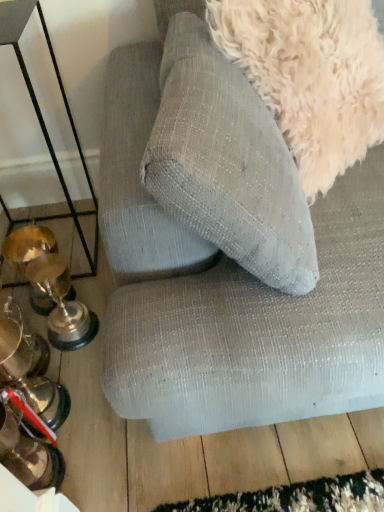
The width and height of the screenshot is (384, 512). In order to click on fuzzy white dog at upper right in this screenshot , I will do `click(310, 76)`.

This screenshot has width=384, height=512. What do you see at coordinates (44, 121) in the screenshot?
I see `metallic trophies at left` at bounding box center [44, 121].

The height and width of the screenshot is (512, 384). Identify the location of fuzzy white dog at upper right. (310, 76).

From a real-world perspective, is metallic trophies at left located beneath fuzzy white dog at upper right?

Yes, from a real-world perspective, metallic trophies at left is below fuzzy white dog at upper right.

Can you confirm if metallic trophies at left is bigger than fuzzy white dog at upper right?

Yes, metallic trophies at left is bigger than fuzzy white dog at upper right.

From the image's perspective, is metallic trophies at left positioned above or below fuzzy white dog at upper right?

Clearly, from the image's perspective, metallic trophies at left is below fuzzy white dog at upper right.

Which is more to the right, metallic trophies at left or fuzzy white dog at upper right?

fuzzy white dog at upper right is more to the right.

Does textured fabric couch at upper center lie behind metallic trophies at left?

No, it is in front of metallic trophies at left.

Which of these two, textured fabric couch at upper center or metallic trophies at left, stands shorter?

Standing shorter between the two is metallic trophies at left.

Based on the photo, between textured fabric couch at upper center and metallic trophies at left, which one has larger width?

Wider between the two is textured fabric couch at upper center.

From the image's perspective, is textured fabric couch at upper center above or below metallic trophies at left?

textured fabric couch at upper center is situated lower than metallic trophies at left in the image.

Based on the photo, from a real-world perspective, who is located higher, fuzzy white dog at upper right or textured fabric couch at upper center?

fuzzy white dog at upper right.

Is fuzzy white dog at upper right touching textured fabric couch at upper center?

They are not placed beside each other.

Is textured fabric couch at upper center inside fuzzy white dog at upper right?

No.

Between point (32, 101) and point (381, 19), which one is positioned behind?

The point (32, 101) is behind.

Is metallic trophies at left next to textured fabric couch at upper center and touching it?

They are not placed beside each other.

Choose the correct answer: Is metallic trophies at left inside textured fabric couch at upper center or outside it?

metallic trophies at left is not enclosed by textured fabric couch at upper center.

From the image's perspective, is metallic trophies at left under textured fabric couch at upper center?

No, from the image's perspective, metallic trophies at left is not below textured fabric couch at upper center.

Between point (311, 77) and point (81, 231), which one is positioned behind?

The point (81, 231) is behind.

Is metallic trophies at left inside fuzzy white dog at upper right?

No, fuzzy white dog at upper right does not contain metallic trophies at left.

Can you confirm if fuzzy white dog at upper right is positioned to the left of metallic trophies at left?

Incorrect, fuzzy white dog at upper right is not on the left side of metallic trophies at left.

From the image's perspective, is fuzzy white dog at upper right under metallic trophies at left?

No, from the image's perspective, fuzzy white dog at upper right is not below metallic trophies at left.

Considering the relative positions of textured fabric couch at upper center and fuzzy white dog at upper right in the image provided, is textured fabric couch at upper center behind fuzzy white dog at upper right?

No, textured fabric couch at upper center is in front of fuzzy white dog at upper right.

Which point is more forward, (293, 329) or (331, 161)?

The point (293, 329) is more forward.

Can you confirm if textured fabric couch at upper center is positioned to the left of fuzzy white dog at upper right?

No.

From the image's perspective, would you say textured fabric couch at upper center is positioned over fuzzy white dog at upper right?

No.

You are a GUI agent. You are given a task and a screenshot of the screen. Output one action in this format:
    pyautogui.click(x=<x>, y=<y>)
    Task: Click on the dog that is on the right side of metallic trophies at left
    The image size is (384, 512).
    Given the screenshot: What is the action you would take?
    pyautogui.click(x=310, y=76)

Identify the location of table above the textured fabric couch at upper center (from the image's perspective). (44, 121).

Looking at the image, which one is located closer to fuzzy white dog at upper right, metallic trophies at left or textured fabric couch at upper center?

Among the two, textured fabric couch at upper center is located nearer to fuzzy white dog at upper right.

Looking at the image, which one is located closer to fuzzy white dog at upper right, textured fabric couch at upper center or metallic trophies at left?

textured fabric couch at upper center is closer to fuzzy white dog at upper right.

From the image, which object appears to be farther from textured fabric couch at upper center, fuzzy white dog at upper right or metallic trophies at left?

Based on the image, metallic trophies at left appears to be further to textured fabric couch at upper center.

Estimate the real-world distances between objects in this image. Which object is further from metallic trophies at left, fuzzy white dog at upper right or textured fabric couch at upper center?

Among the two, fuzzy white dog at upper right is located further to metallic trophies at left.

When comparing their distances from metallic trophies at left, does textured fabric couch at upper center or fuzzy white dog at upper right seem closer?

textured fabric couch at upper center is positioned closer to the anchor metallic trophies at left.

Based on their spatial positions, is metallic trophies at left or fuzzy white dog at upper right further from textured fabric couch at upper center?

metallic trophies at left is further to textured fabric couch at upper center.

The height and width of the screenshot is (512, 384). In order to click on dog located between metallic trophies at left and textured fabric couch at upper center in the left-right direction in this screenshot , I will do tap(310, 76).